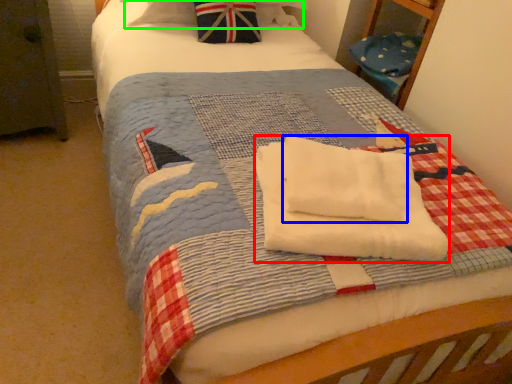
Question: Considering the real-world distances, which object is closest to beach towel (highlighted by a red box)? beach towel (highlighted by a blue box) or pillow (highlighted by a green box).

Choices:
 (A) beach towel
 (B) pillow

Answer: (A)